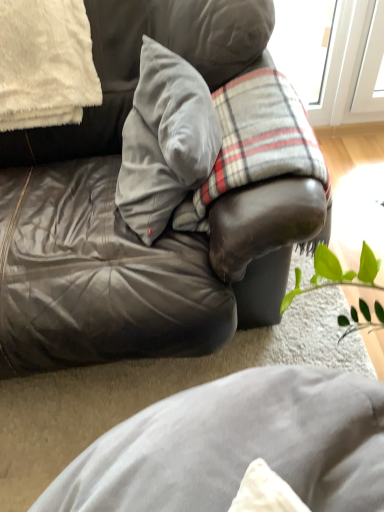
Question: Is plaid fabric at center touching velvet gray pillow at center, the 1th pillow positioned from the right?

Choices:
 (A) no
 (B) yes

Answer: (A)

Question: Does plaid fabric at center have a greater width compared to velvet gray pillow at center, which ranks as the 2th pillow in left-to-right order?

Choices:
 (A) yes
 (B) no

Answer: (A)

Question: Does plaid fabric at center come in front of velvet gray pillow at center, the 1th pillow positioned from the right?

Choices:
 (A) yes
 (B) no

Answer: (B)

Question: Is plaid fabric at center facing towards velvet gray pillow at center, the 1th pillow positioned from the right?

Choices:
 (A) yes
 (B) no

Answer: (B)

Question: Would you say velvet gray pillow at center, the 1th pillow positioned from the right, is part of plaid fabric at center's contents?

Choices:
 (A) yes
 (B) no

Answer: (A)

Question: Is plaid fabric at center at the right side of velvet gray pillow at center, the 1th pillow positioned from the right?

Choices:
 (A) no
 (B) yes

Answer: (B)

Question: Is white fluffy pillow at upper left, arranged as the first pillow when viewed from the left, smaller than plaid fabric at center?

Choices:
 (A) no
 (B) yes

Answer: (B)

Question: Is white fluffy pillow at upper left, the second pillow when ordered from right to left, positioned before plaid fabric at center?

Choices:
 (A) no
 (B) yes

Answer: (A)

Question: Is there a large distance between white fluffy pillow at upper left, arranged as the first pillow when viewed from the left, and plaid fabric at center?

Choices:
 (A) no
 (B) yes

Answer: (A)

Question: Can you confirm if white fluffy pillow at upper left, the second pillow when ordered from right to left, is positioned to the right of plaid fabric at center?

Choices:
 (A) no
 (B) yes

Answer: (A)

Question: From a real-world perspective, is white fluffy pillow at upper left, arranged as the first pillow when viewed from the left, physically above plaid fabric at center?

Choices:
 (A) no
 (B) yes

Answer: (B)

Question: Is white fluffy pillow at upper left, arranged as the first pillow when viewed from the left, bigger than plaid fabric at center?

Choices:
 (A) no
 (B) yes

Answer: (A)

Question: Is plaid fabric at center oriented towards white fluffy pillow at upper left, arranged as the first pillow when viewed from the left?

Choices:
 (A) no
 (B) yes

Answer: (A)